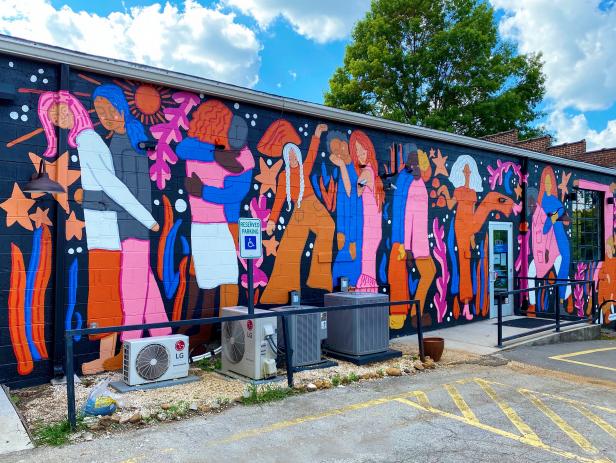
At what (x,y) coordinates should I click in order to perform the action: click on light grey ac unit. Please return your answer as a coordinate pair (x, y). Looking at the image, I should click on (164, 345), (257, 342).